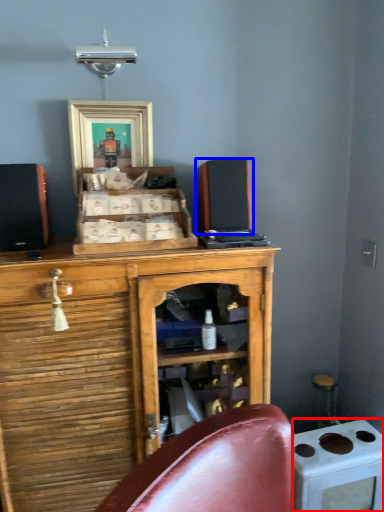
Question: Which object appears closest to the camera in this image, appliance (highlighted by a red box) or speaker (highlighted by a blue box)?

Choices:
 (A) appliance
 (B) speaker

Answer: (B)